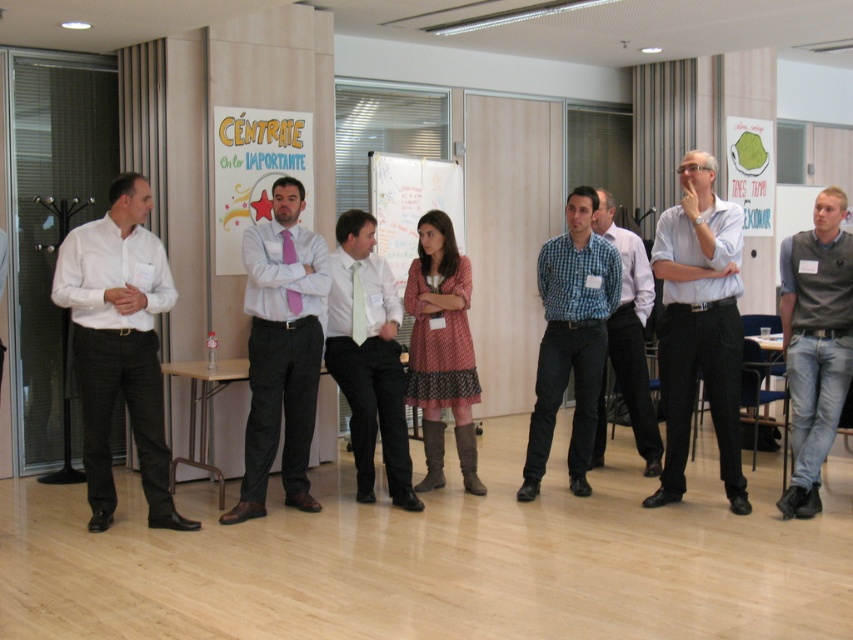
You are organizing a charity event and need to arrange two items on a table. The light green silk tie at center and the matte black suit at left must be placed side by side. Based on their widths, which one should be placed on the left to ensure they fit within the table space?

The light green silk tie at center is wider than the matte black suit at left, so placing the wider light green silk tie at center on the left ensures they fit within the table space.

You are organizing a photo shoot and need to position the models according to their attire. Given the scene, which model is positioned to the right of the other between the blue checkered shirt at center and the matte black suit at left?

The blue checkered shirt at center is positioned to the right of the matte black suit at left.